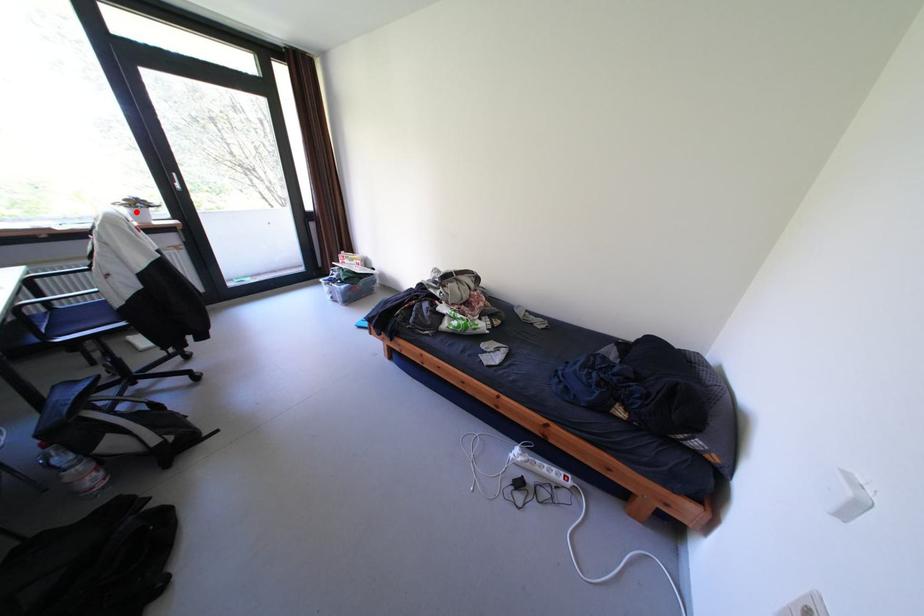
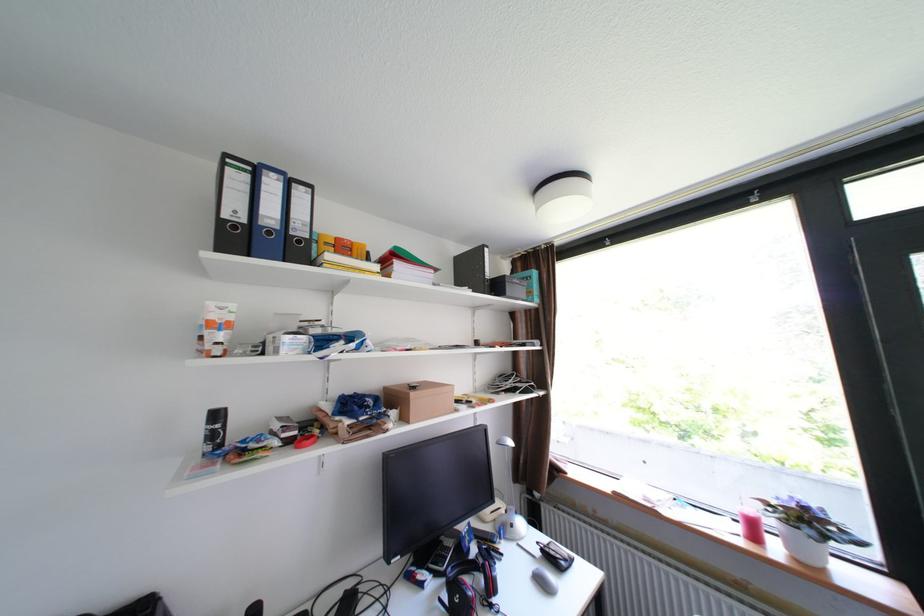
Question: I am providing you with two images of the same scene from different viewpoints. A red point is marked on the first image. At the location where the point appears in image 1, is it still visible in image 2?

Choices:
 (A) Yes
 (B) No

Answer: (A)